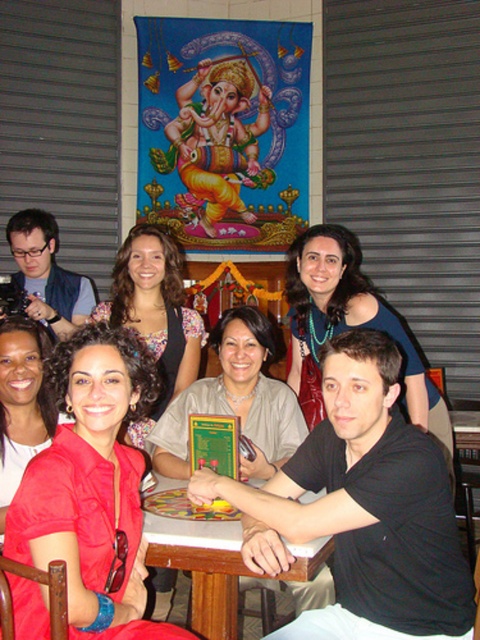
Looking at this image, you are a fashion designer observing the group of people in the image. You notice two blouses worn by different women. The floral blouse at center and the matte red blouse at lower left. Which blouse has a larger size?

The floral blouse at center is bigger than the matte red blouse at lower left, so the floral blouse at center has a larger size.

In the scene described, there are two red items at the lower left corner of the image. The red satin dress at lower left and the matte red blouse at lower left. From the perspective of someone facing the image, which one is positioned more to the right?

The red satin dress at lower left is positioned more to the right compared to the matte red blouse at lower left.

In the scene described, there are two blouses visible. The floral blouse at center and the matte red blouse at lower left. Which blouse is positioned to the right of the other?

The floral blouse at center is positioned to the right of the matte red blouse at lower left.